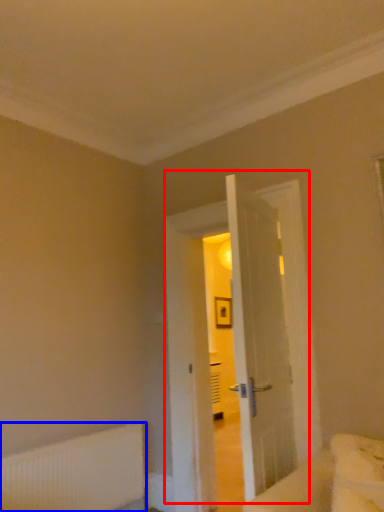
Question: Among these objects, which one is nearest to the camera, door (highlighted by a red box) or radiator (highlighted by a blue box)?

Choices:
 (A) door
 (B) radiator

Answer: (B)